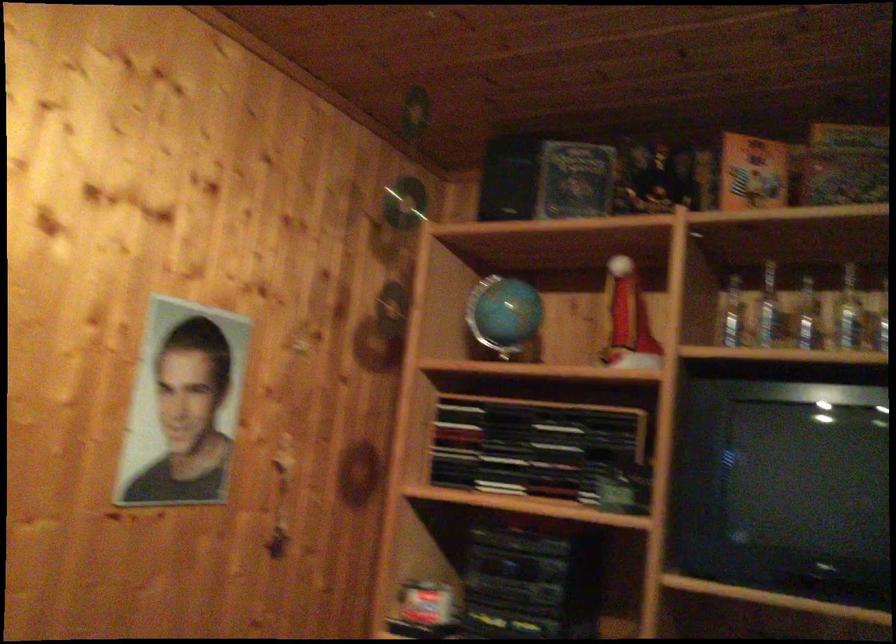
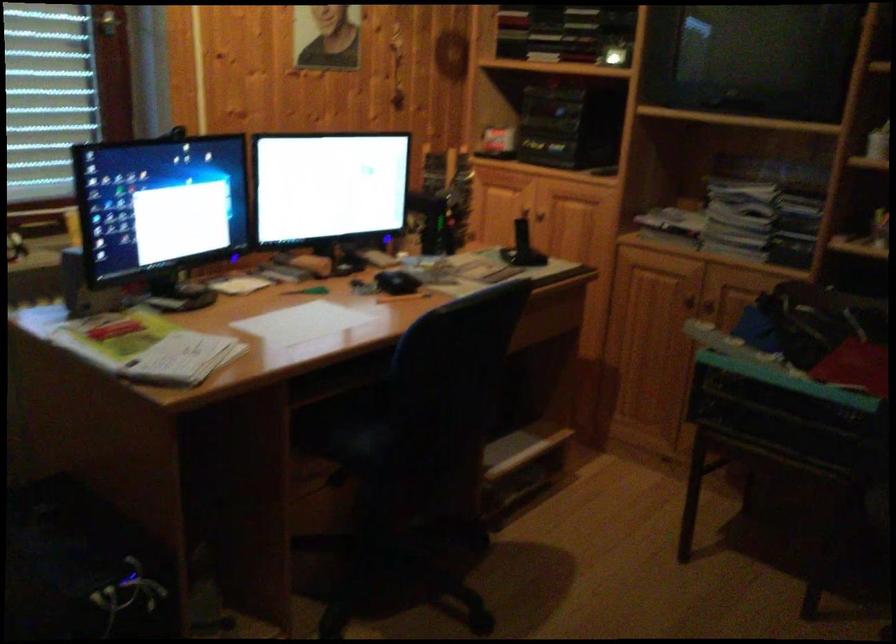
Which direction would the cameraman need to move to produce the second image?

The cameraman walked toward right, backward.